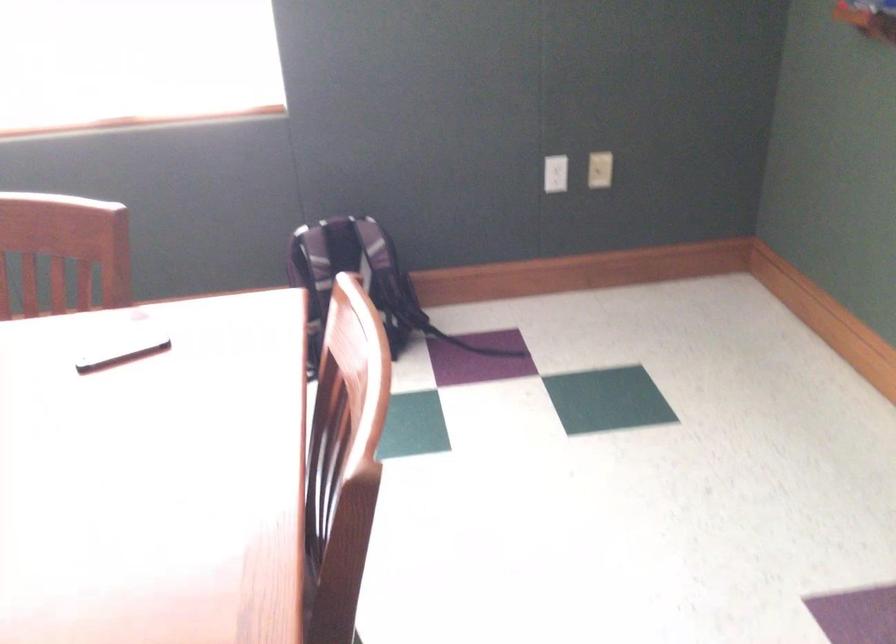
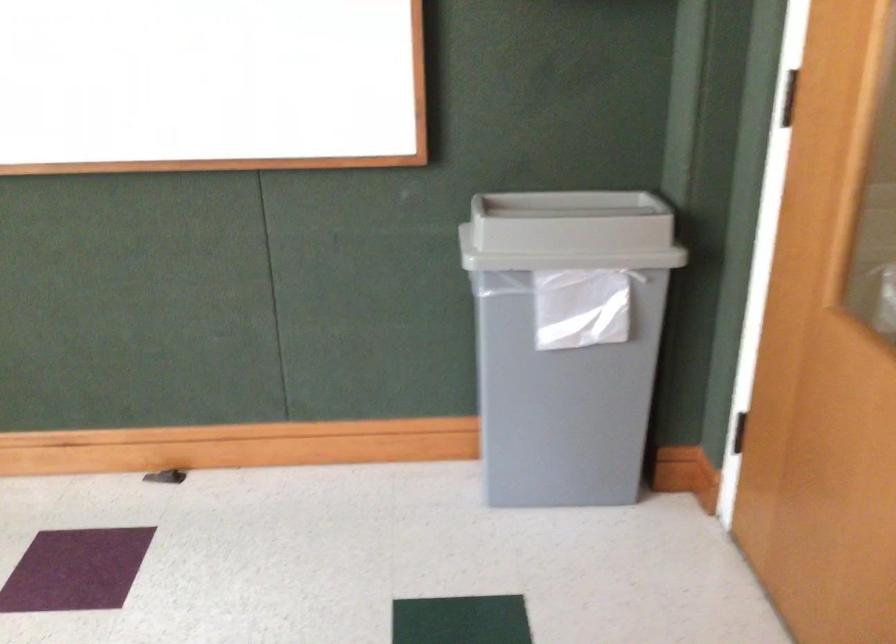
Question: The first image is from the beginning of the video and the second image is from the end. How did the camera likely rotate when shooting the video?

Choices:
 (A) Left
 (B) Right
 (C) Up
 (D) Down

Answer: (B)